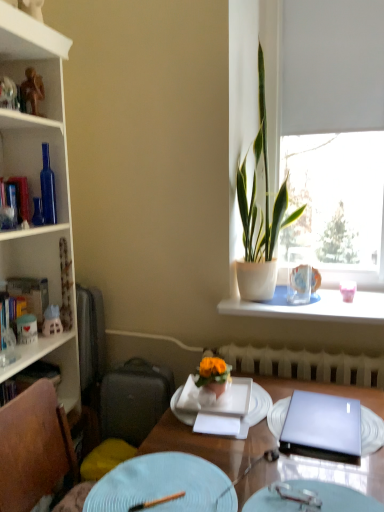
Identify the location of vacant area that lies to the right of metallic silver fork at center, marked as the 2th tableware in a top-to-bottom arrangement. The height and width of the screenshot is (512, 384). (344, 487).